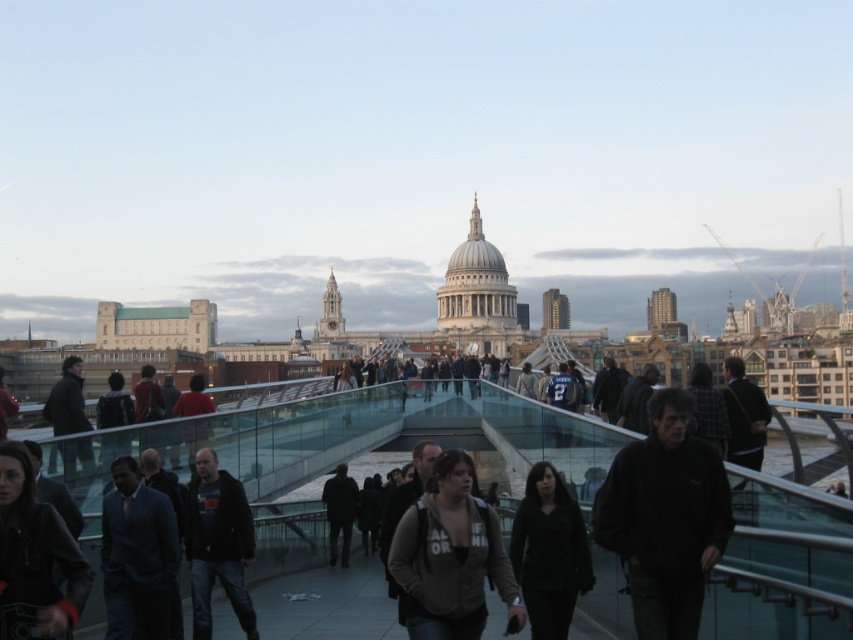
Who is higher up, black leather jacket at lower left or dark gray fabric jacket at center?

black leather jacket at lower left

Can you confirm if black leather jacket at lower left is taller than dark gray fabric jacket at center?

Indeed, black leather jacket at lower left has a greater height compared to dark gray fabric jacket at center.

Who is more distant from viewer, (28, 468) or (573, 547)?

Positioned behind is point (573, 547).

Find the location of a particular element. black leather jacket at lower left is located at coordinates (33, 557).

Who is higher up, dark blue suit at center or dark gray fabric jacket at center?

dark gray fabric jacket at center

Who is lower down, dark blue suit at center or dark gray fabric jacket at center?

Positioned lower is dark blue suit at center.

Identify the location of dark blue suit at center. This screenshot has height=640, width=853. (137, 556).

Is dark brown leather jacket at center further to the viewer compared to dark blue suit at center?

No, it is in front of dark blue suit at center.

Does dark brown leather jacket at center appear on the left side of dark blue suit at center?

In fact, dark brown leather jacket at center is to the right of dark blue suit at center.

Where is `dark brown leather jacket at center`? Image resolution: width=853 pixels, height=640 pixels. dark brown leather jacket at center is located at coordinates click(450, 557).